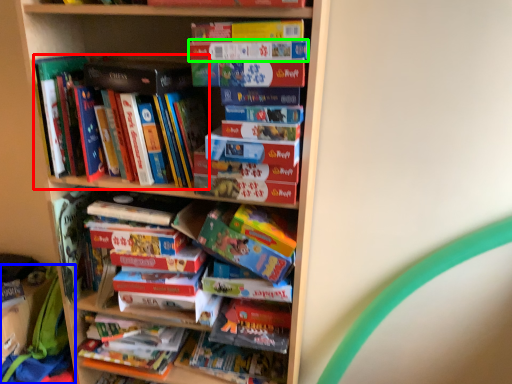
Question: Considering the real-world distances, which object is farthest from book (highlighted by a red box)? backpack (highlighted by a blue box) or paperback book (highlighted by a green box)?

Choices:
 (A) backpack
 (B) paperback book

Answer: (A)